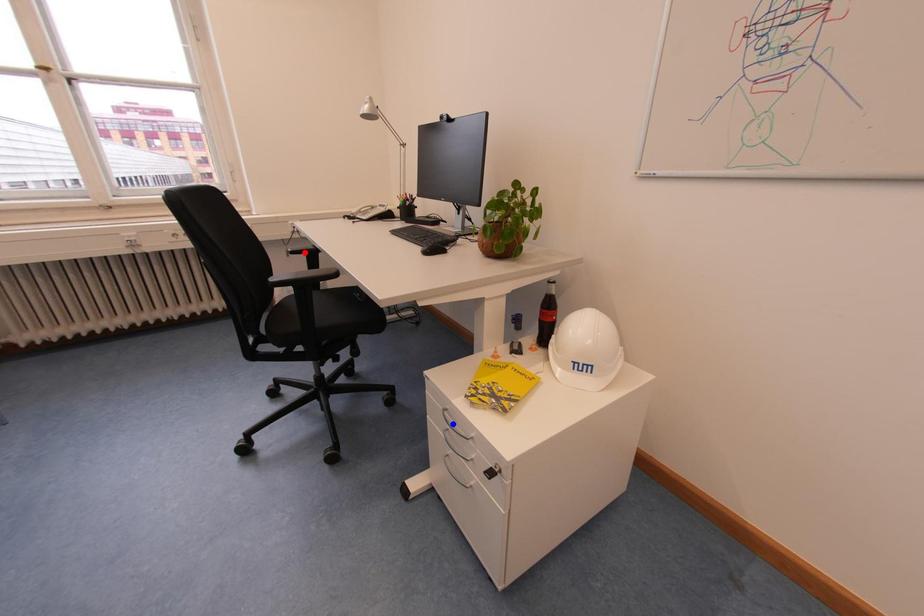
Question: In the image, two points are highlighted. Which point is nearer to the camera? Reply with the corresponding letter.

Choices:
 (A) blue point
 (B) red point

Answer: (A)